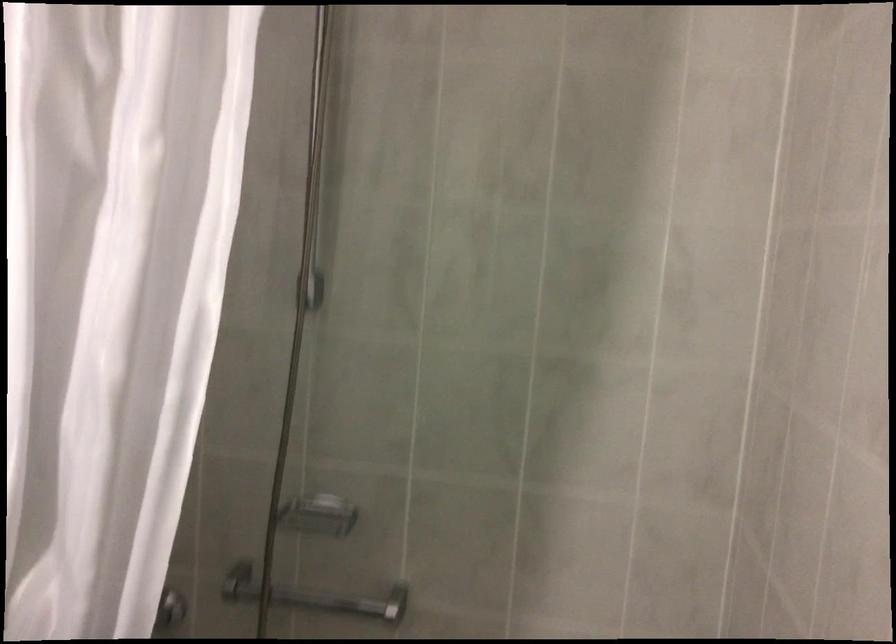
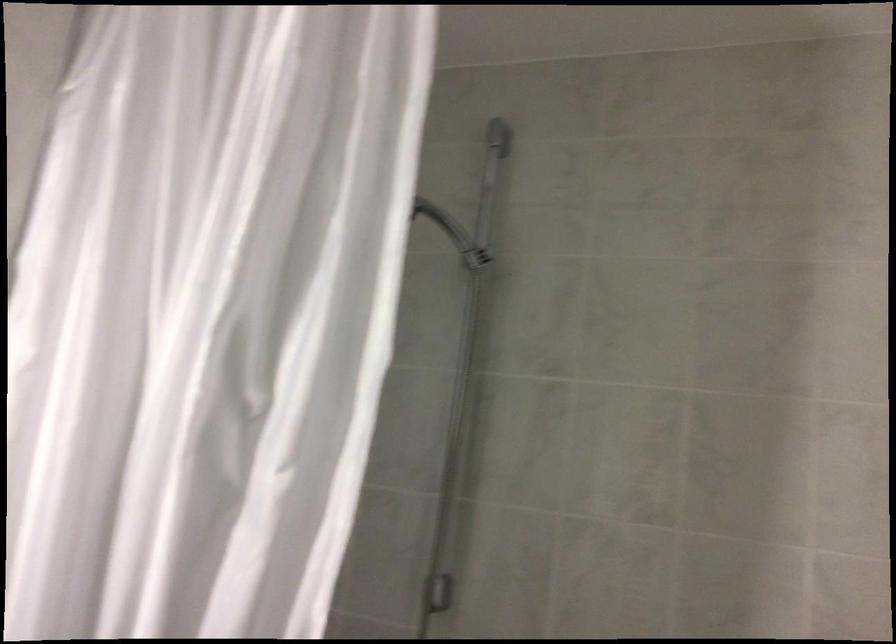
Which direction would the cameraman need to move to produce the second image?

The movement direction of the cameraman is right, backward.